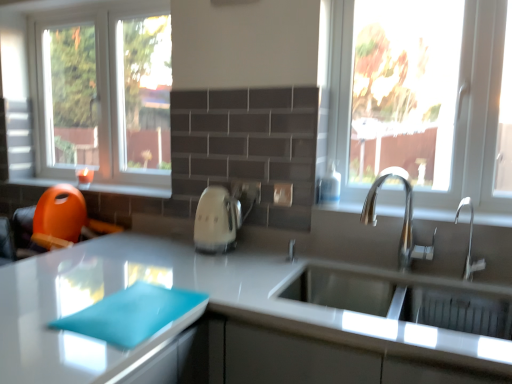
The width and height of the screenshot is (512, 384). Identify the location of free space in front of satin nickel faucet at sink right, positioned as the second tap in left-to-right order. (483, 284).